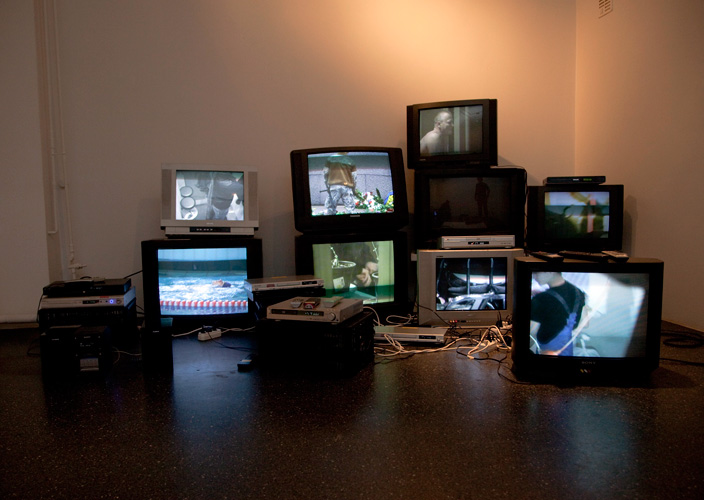
I want to click on floor, so click(358, 446).